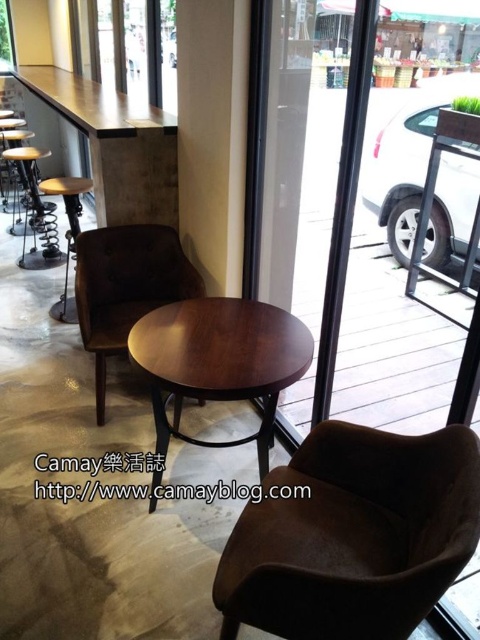
Does transparent glass door at center have a smaller size compared to wooden seat at left?

No, transparent glass door at center is not smaller than wooden seat at left.

Is point (280, 32) positioned before point (35, 148)?

Yes, it is in front of point (35, 148).

At what (x,y) coordinates should I click in order to perform the action: click on transparent glass door at center. Please return your answer as a coordinate pair (x, y). Image resolution: width=480 pixels, height=640 pixels. Looking at the image, I should click on (303, 150).

Which is in front, point (104, 307) or point (35, 208)?

Point (104, 307) is more forward.

Who is positioned more to the left, brown leather armchair at center or wooden seat at left?

Positioned to the left is wooden seat at left.

Locate an element on the screen. The width and height of the screenshot is (480, 640). brown leather armchair at center is located at coordinates (126, 285).

Is transparent glass door at center taller than wooden round table at center?

Indeed, transparent glass door at center has a greater height compared to wooden round table at center.

Between transparent glass door at center and wooden round table at center, which one is positioned lower?

wooden round table at center is lower down.

Identify the location of transparent glass door at center. (303, 150).